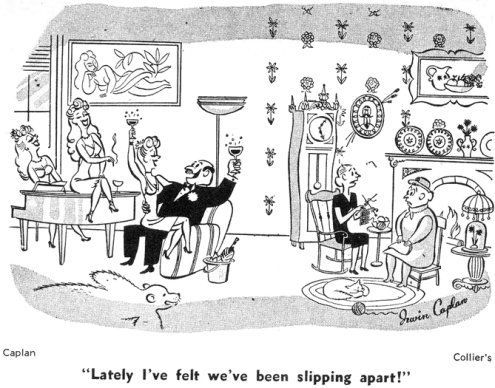
Where is `rug`? rug is located at coordinates (391, 295).